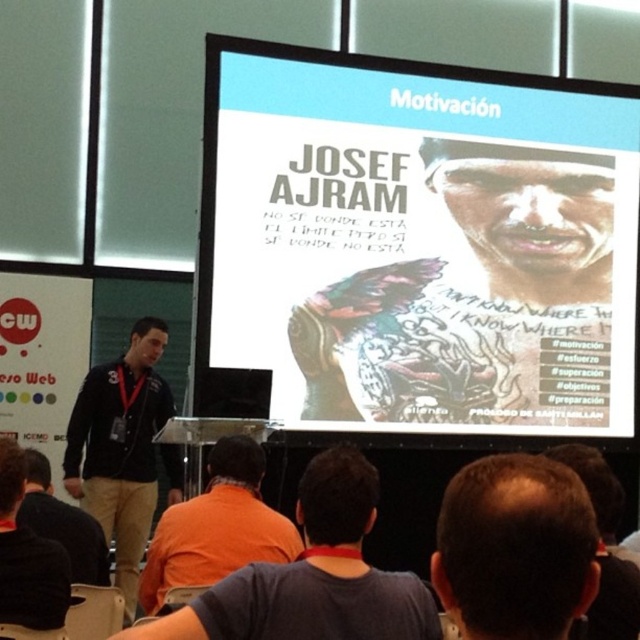
Based on the scene described, which object is shorter between the dark brown hair at upper center and the orange fabric shirt at lower center?

The dark brown hair at upper center is shorter than the orange fabric shirt at lower center according to the description.

You are organizing a clothing display and need to arrange the orange fabric shirt at lower center and the black fabric shirt at lower left based on their positions in the image. Which shirt should be placed higher on the display rack?

The orange fabric shirt at lower center should be placed higher on the display rack because it is above the black fabric shirt at lower left in the image.